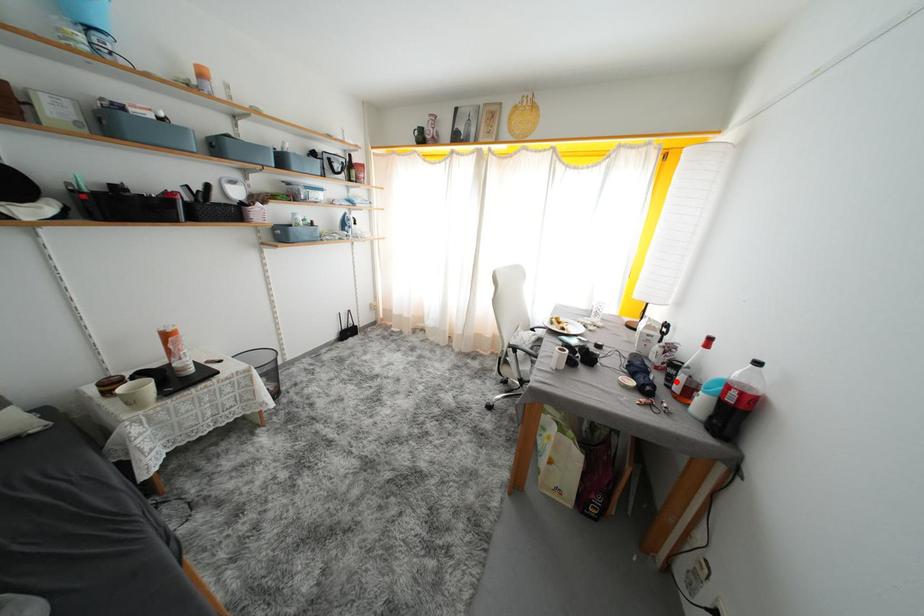
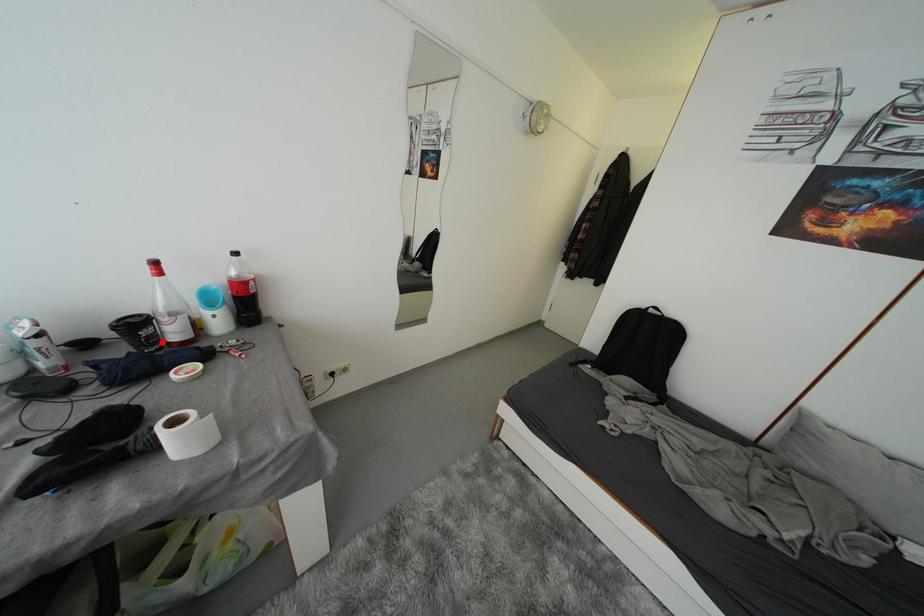
I am providing you with two images of the same scene from different viewpoints. A red point is marked on the first image and another point is marked on the second image. Is the red point in image1 aligned with the point shown in image2?

Yes